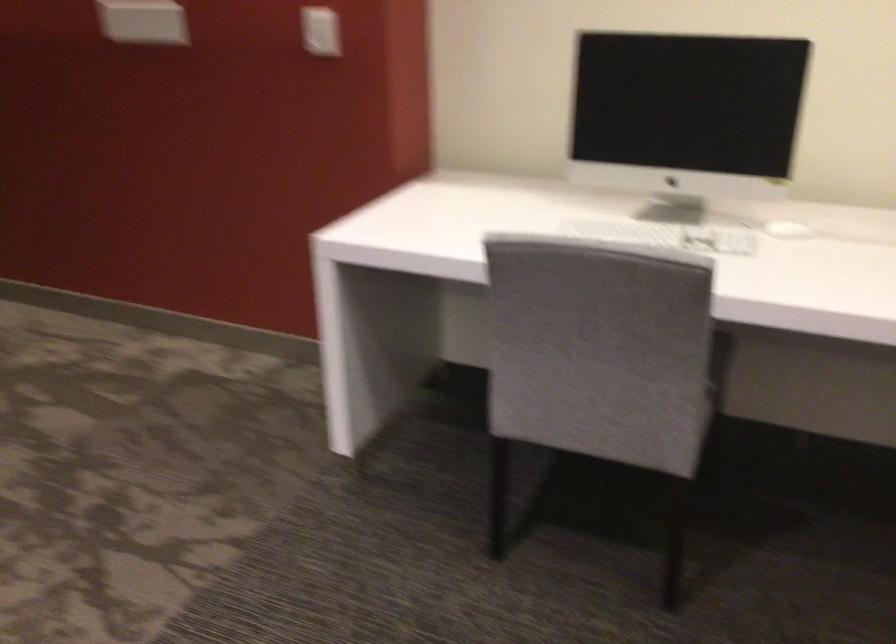
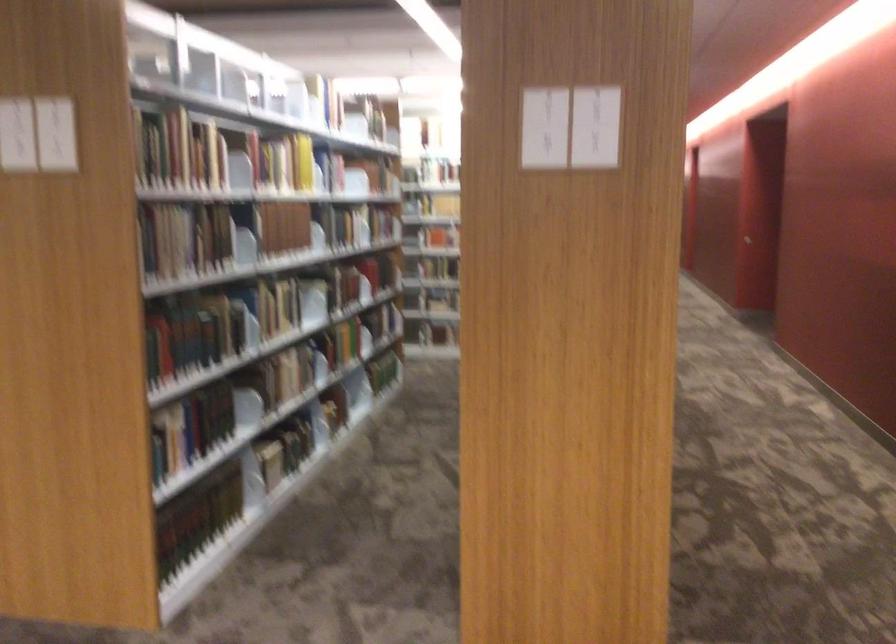
Question: The camera is either moving clockwise (left) or counter-clockwise (right) around the object. The first image is from the beginning of the video and the second image is from the end. Is the camera moving left or right when shooting the video?

Choices:
 (A) Left
 (B) Right

Answer: (B)